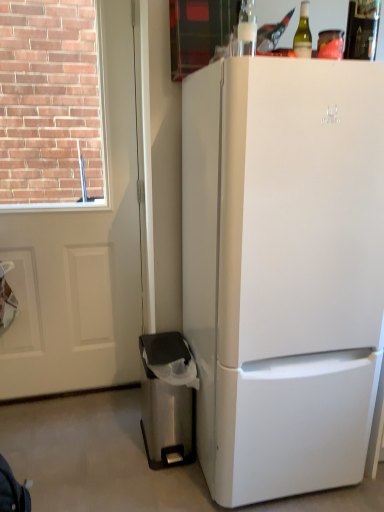
In order to click on unoccupied area in front of stainless steel trash can at lower left in this screenshot , I will do `click(156, 489)`.